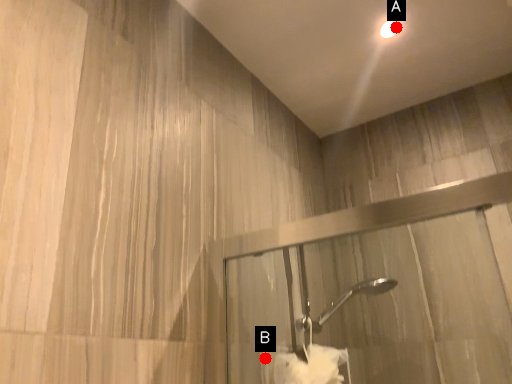
Question: Two points are circled on the image, labeled by A and B beside each circle. Which point appears farthest from the camera in this image?

Choices:
 (A) A is further
 (B) B is further

Answer: (A)